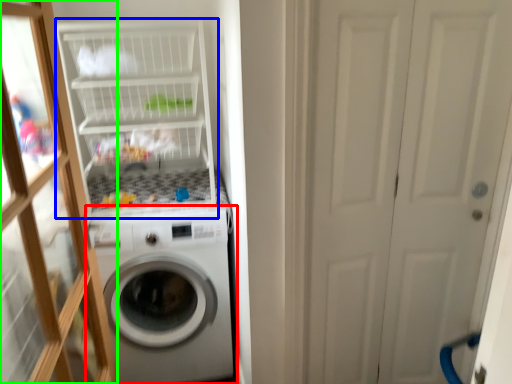
Question: Which is nearer to the washing machine (highlighted by a red box)? shelf (highlighted by a blue box) or glass door (highlighted by a green box).

Choices:
 (A) shelf
 (B) glass door

Answer: (A)